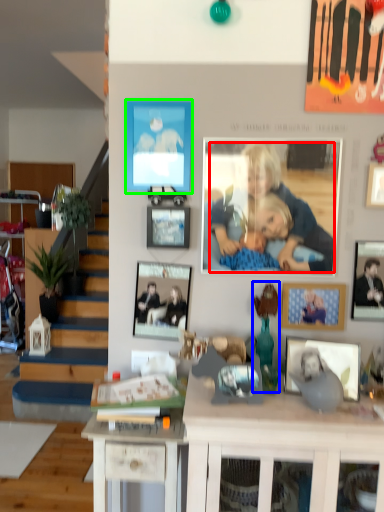
Question: Which is farther away from person (highlighted by a red box)? toy (highlighted by a blue box) or picture frame (highlighted by a green box)?

Choices:
 (A) toy
 (B) picture frame

Answer: (A)